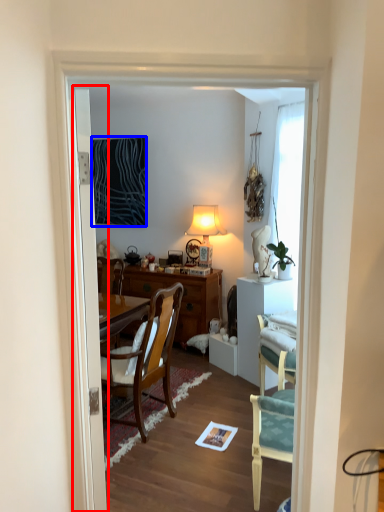
Question: Which object is further to the camera taking this photo, door (highlighted by a red box) or picture frame (highlighted by a blue box)?

Choices:
 (A) door
 (B) picture frame

Answer: (B)